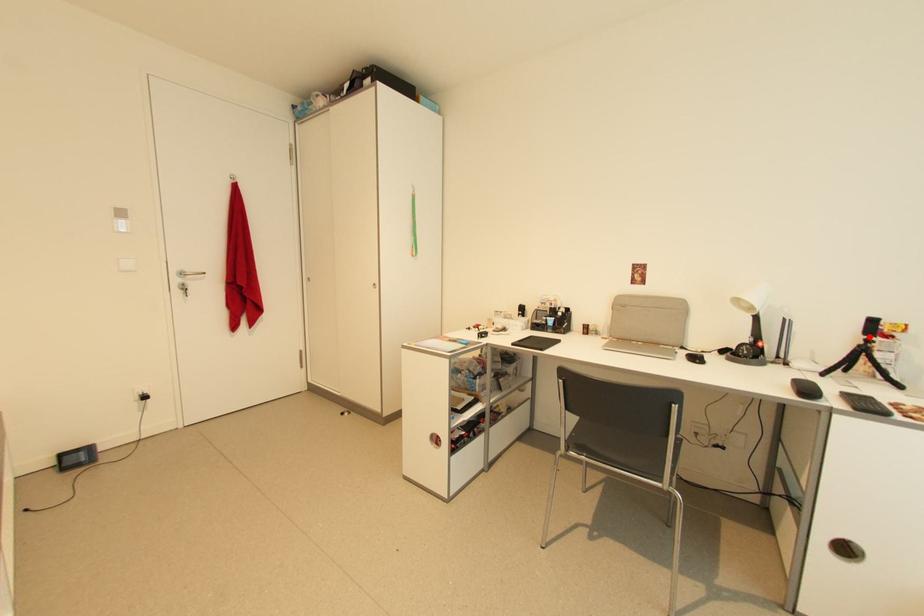
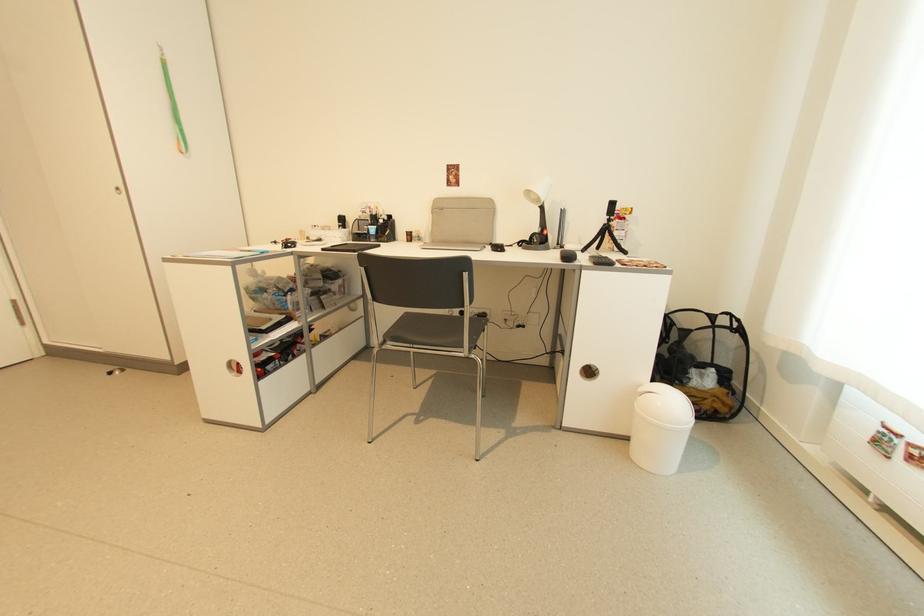
Locate, in the second image, the point that corresponds to the highlighted location in the first image.

(612, 217)